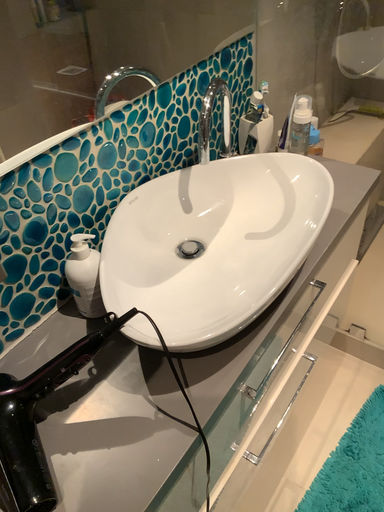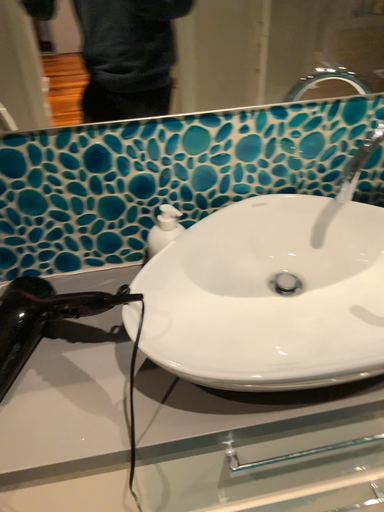
Question: Which way did the camera rotate in the video?

Choices:
 (A) rotated upward
 (B) rotated downward

Answer: (A)